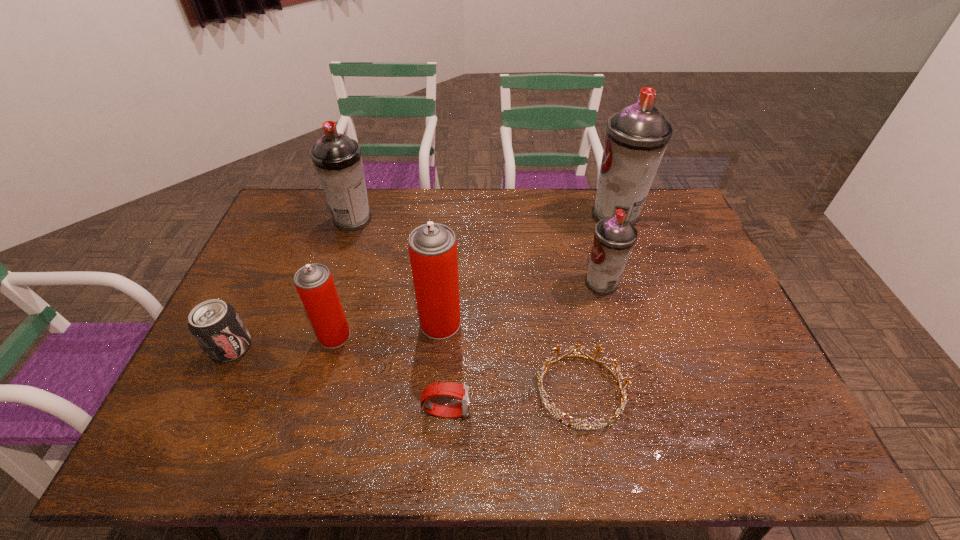
Identify the location of vacant space that's between the smaller red aerosol can and the leftmost object. (283, 341).

This screenshot has height=540, width=960. I want to click on free space between the right red aerosol can and the shortest object, so click(x=511, y=357).

Identify the location of free space between the smaller red aerosol can and the leftmost object. The height and width of the screenshot is (540, 960). [283, 341].

Locate an element on the screen. This screenshot has height=540, width=960. object that is the second closest to the second shortest object is located at coordinates (432, 247).

Where is `object that is the fifth closest one to the third farthest object`? This screenshot has width=960, height=540. object that is the fifth closest one to the third farthest object is located at coordinates (314, 283).

Select which aerosol can is the closest to the smallest gray aerosol can. Please provide its 2D coordinates. Your answer should be formatted as a tuple, i.e. [(x, y)], where the tuple contains the x and y coordinates of a point satisfying the conditions above.

[(636, 138)]

Identify which aerosol can is the third closest to the biggest gray aerosol can. Please provide its 2D coordinates. Your answer should be formatted as a tuple, i.e. [(x, y)], where the tuple contains the x and y coordinates of a point satisfying the conditions above.

[(337, 158)]

Choose which gray aerosol can is the second nearest neighbor to the black soda can. Please provide its 2D coordinates. Your answer should be formatted as a tuple, i.e. [(x, y)], where the tuple contains the x and y coordinates of a point satisfying the conditions above.

[(614, 238)]

Locate an element on the screen. The image size is (960, 540). gray aerosol can that can be found as the closest to the tiara is located at coordinates (614, 238).

The image size is (960, 540). What are the coordinates of `vacant space that satisfies the following two spatial constraints: 1. on the front side of the biggest gray aerosol can; 2. on the face of the red watch` in the screenshot? It's located at (683, 411).